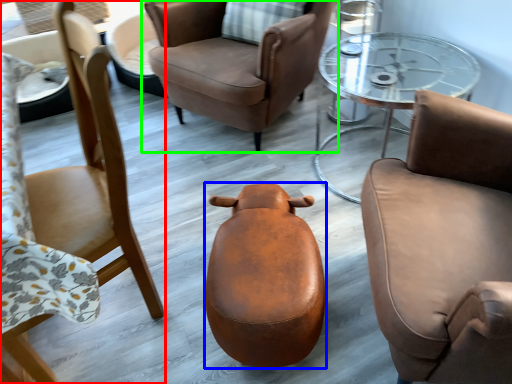
Question: Estimate the real-world distances between objects in this image. Which object is closer to chair (highlighted by a red box), stool (highlighted by a blue box) or chair (highlighted by a green box)?

Choices:
 (A) stool
 (B) chair

Answer: (A)